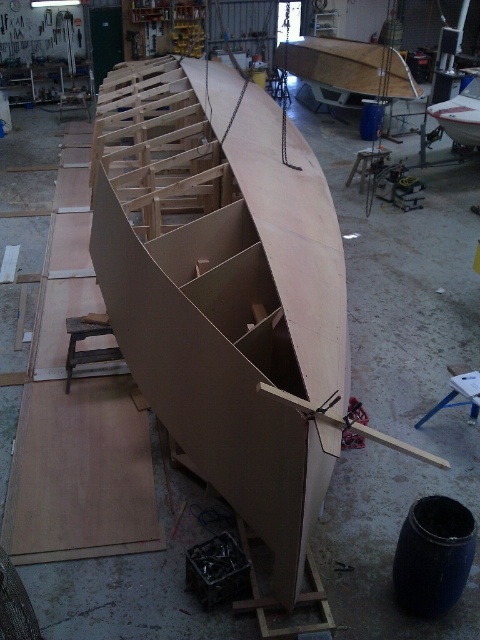
Question: Among these objects, which one is farthest from the camera?

Choices:
 (A) light brown wood boat at center
 (B) matte wood boat at center

Answer: (B)

Question: Which object is closer to the camera taking this photo?

Choices:
 (A) matte wood boat at center
 (B) light brown wood boat at center

Answer: (B)

Question: Which object appears closest to the camera in this image?

Choices:
 (A) light brown wood boat at center
 (B) matte wood boat at center

Answer: (A)

Question: Where is light brown wood boat at center located in relation to matte wood boat at center in the image?

Choices:
 (A) left
 (B) right

Answer: (A)

Question: Can you confirm if light brown wood boat at center is positioned to the right of matte wood boat at center?

Choices:
 (A) no
 (B) yes

Answer: (A)

Question: Is light brown wood boat at center positioned at the back of matte wood boat at center?

Choices:
 (A) no
 (B) yes

Answer: (A)